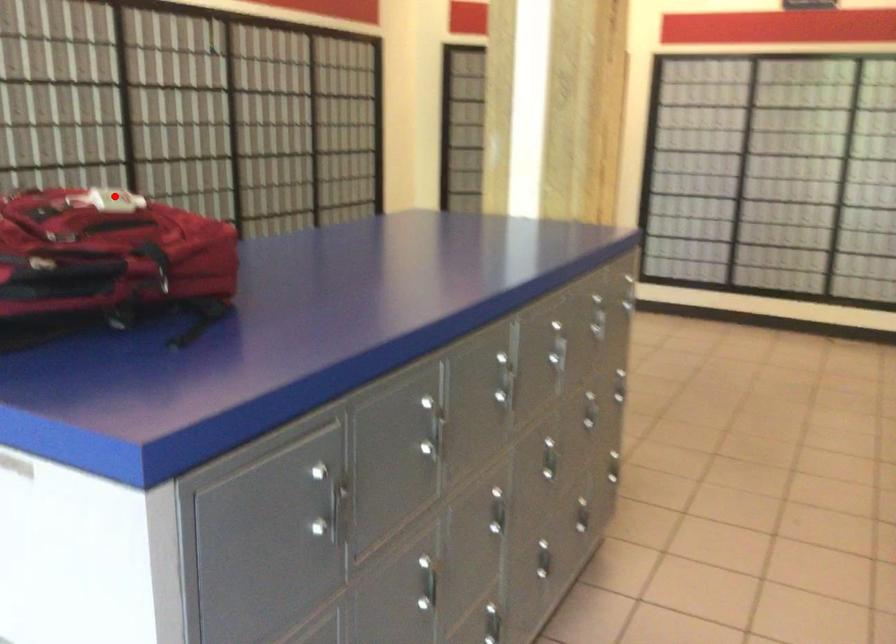
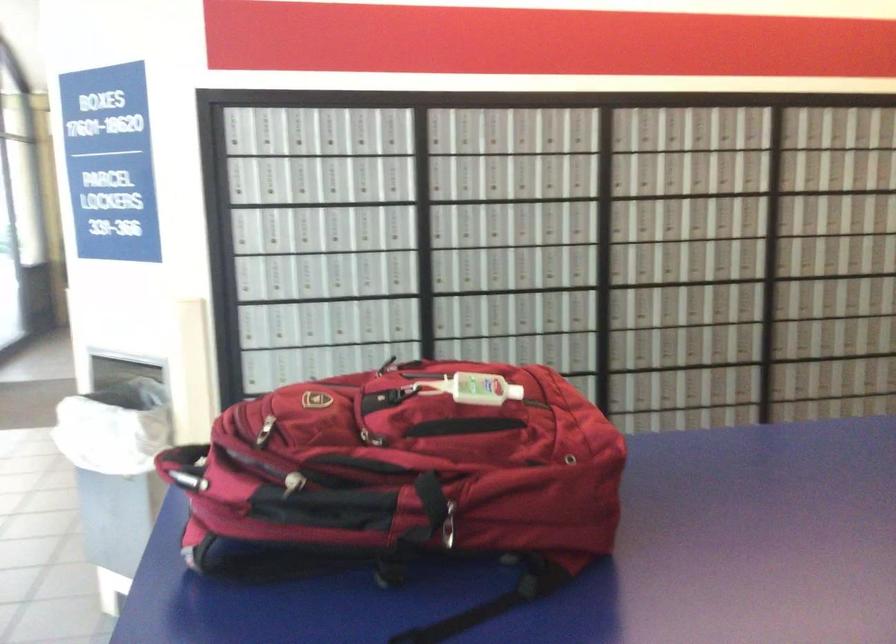
Question: I am providing you with two images of the same scene from different viewpoints. Given a red point in image1, look at the same physical point in image2. Is it:

Choices:
 (A) Closer to the viewpoint
 (B) Farther from the viewpoint

Answer: (A)